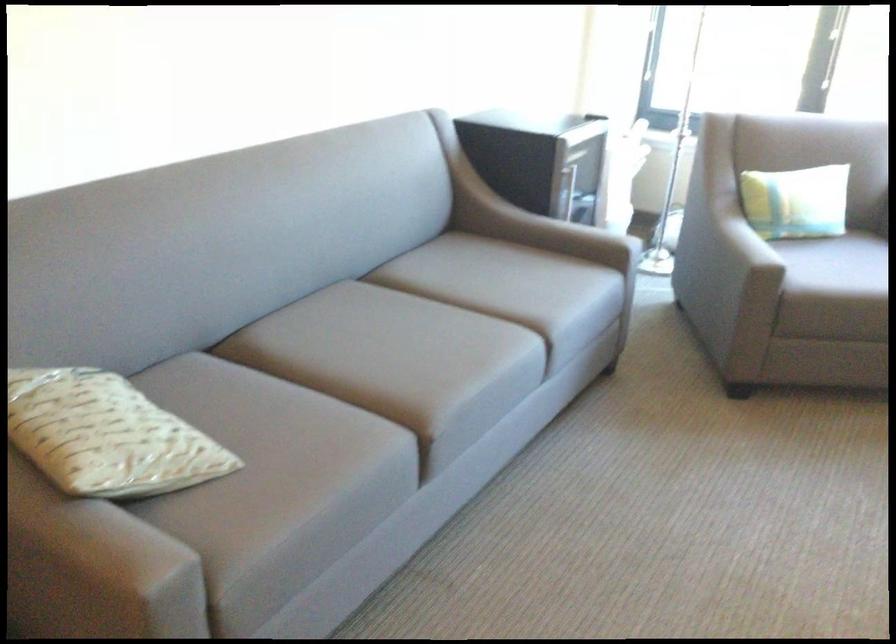
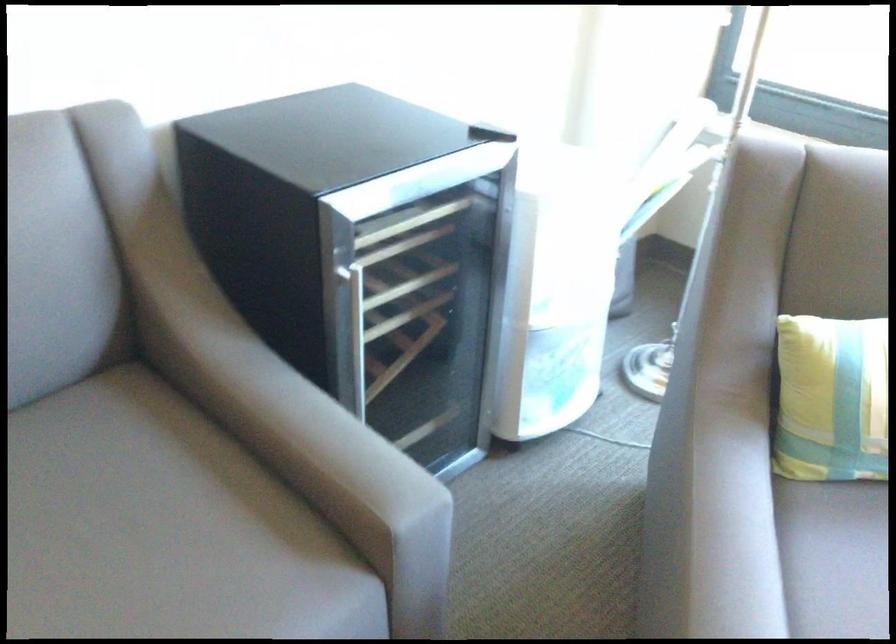
The point at [702,240] is marked in the first image. Where is the corresponding point in the second image?

(711, 522)